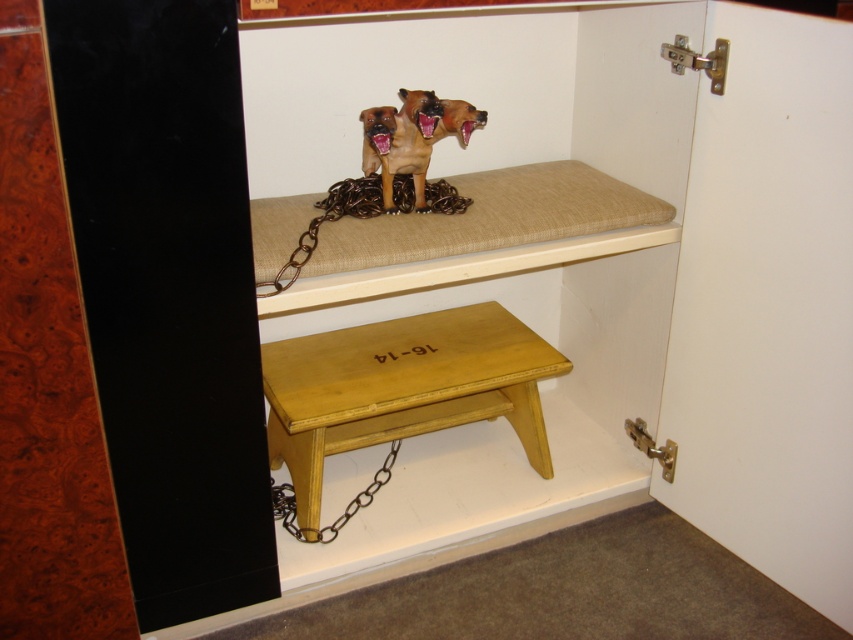
Does brown matte dog at upper center appear on the left side of metallic chain at lower center?

Incorrect, brown matte dog at upper center is not on the left side of metallic chain at lower center.

Looking at this image, does brown matte dog at upper center have a greater width compared to metallic chain at lower center?

No.

The width and height of the screenshot is (853, 640). What do you see at coordinates (412, 138) in the screenshot? I see `brown matte dog at upper center` at bounding box center [412, 138].

At what (x,y) coordinates should I click in order to perform the action: click on brown matte dog at upper center. Please return your answer as a coordinate pair (x, y). Looking at the image, I should click on (412, 138).

This screenshot has width=853, height=640. I want to click on yellow wood step stool at lower center, so click(401, 388).

Who is positioned more to the right, yellow wood step stool at lower center or metallic chain at lower center?

yellow wood step stool at lower center

In order to click on yellow wood step stool at lower center in this screenshot , I will do `click(401, 388)`.

Who is lower down, brown matte dog at upper center or brown metallic chain at upper center?

brown metallic chain at upper center is below.

Can you confirm if brown matte dog at upper center is bigger than brown metallic chain at upper center?

Incorrect, brown matte dog at upper center is not larger than brown metallic chain at upper center.

Is point (386, 195) closer to camera compared to point (289, 257)?

That is False.

Find the location of `brown matte dog at upper center`. brown matte dog at upper center is located at coordinates (412, 138).